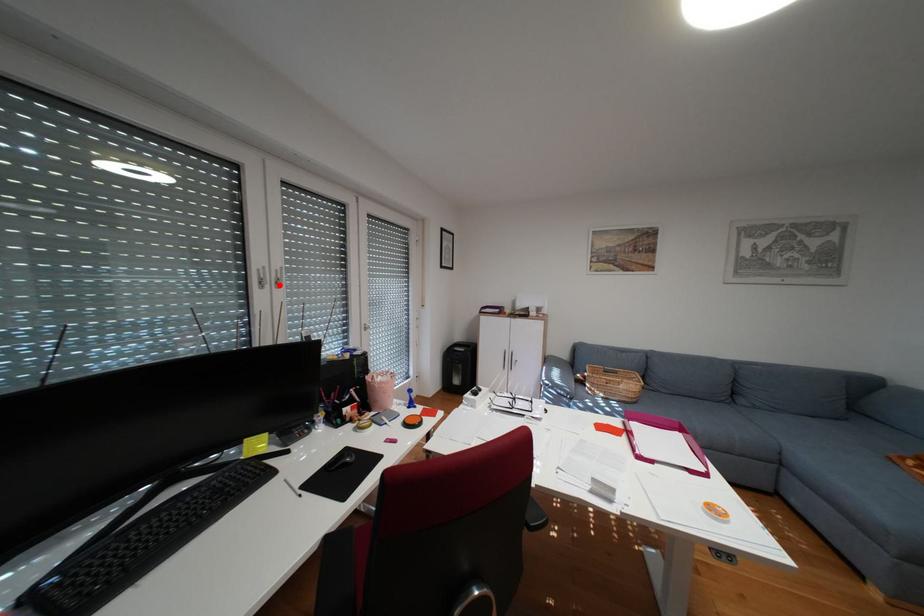
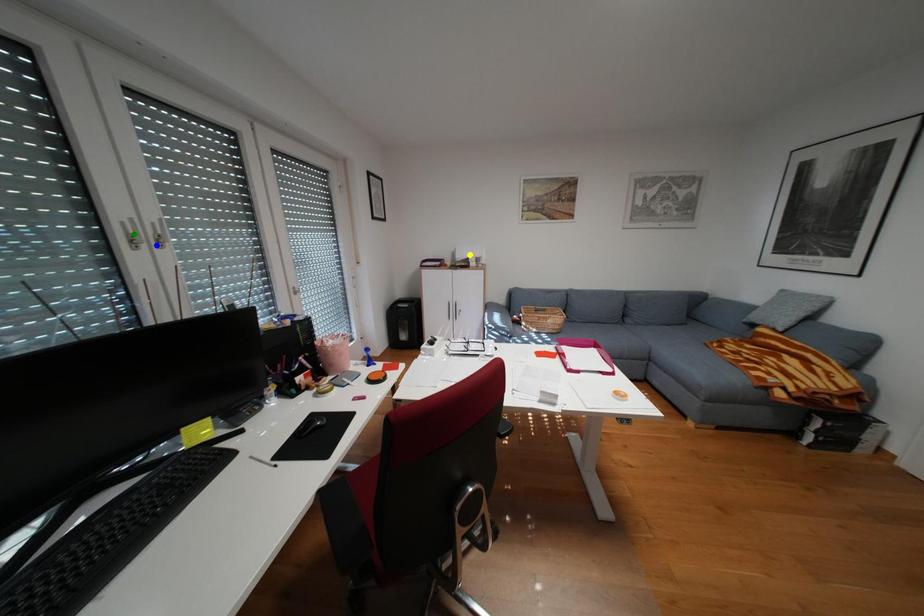
Question: I am providing you with two images of the same scene from different viewpoints. A red point is marked on the first image. You are given multiple points on the second image. Which spot in image 2 lines up with the point in image 1?

Choices:
 (A) yellow point
 (B) green point
 (C) blue point

Answer: (C)